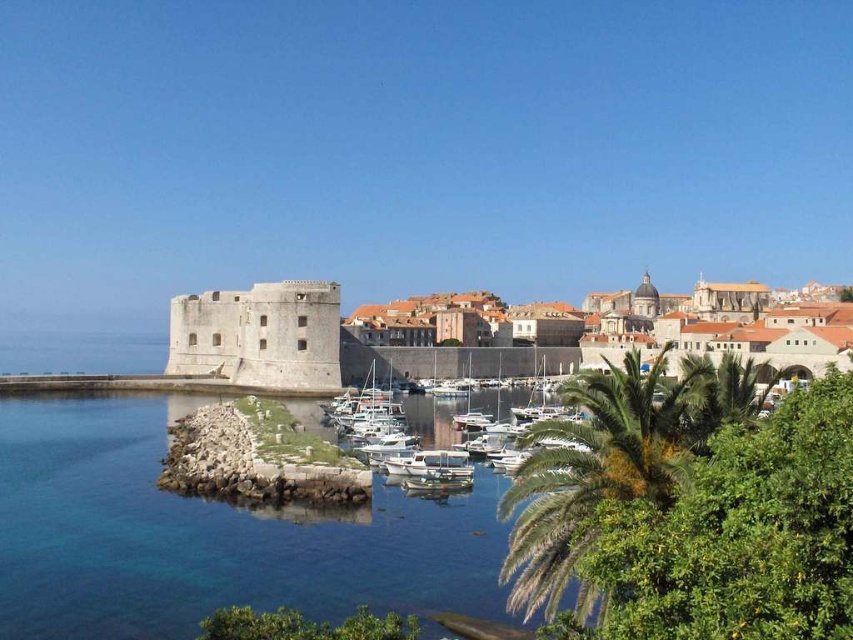
Question: Can you confirm if clear blue water at lower left is positioned below green leafy palm tree at lower right?

Choices:
 (A) no
 (B) yes

Answer: (B)

Question: Which is farther from the green leafy palm tree at lower right?

Choices:
 (A) clear blue water at lower left
 (B) gray stone castle at left

Answer: (B)

Question: Which is farther from the gray stone castle at left?

Choices:
 (A) green leafy palm tree at lower right
 (B) terracotta tiled roofs at center

Answer: (A)

Question: Is clear blue water at lower left smaller than gray stone castle at left?

Choices:
 (A) yes
 (B) no

Answer: (B)

Question: Does terracotta tiled roofs at center have a larger size compared to gray stone castle at left?

Choices:
 (A) no
 (B) yes

Answer: (B)

Question: Which point is closer to the camera?

Choices:
 (A) gray stone castle at left
 (B) clear blue water at lower left
 (C) white glossy boats at center
 (D) green leafy palm tree at lower right

Answer: (D)